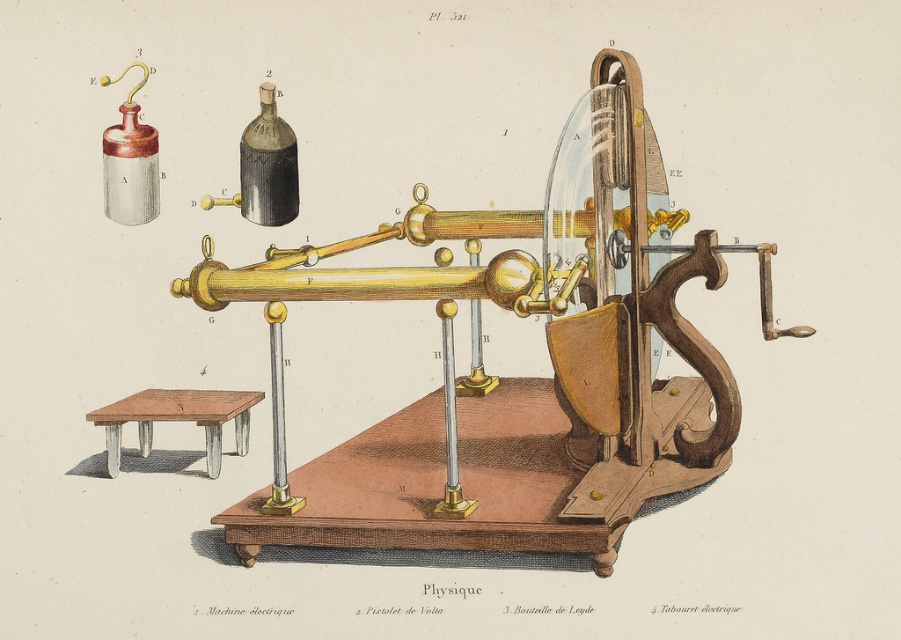
You are an engineer working on a precision instrument. You need to place a small tool between the polished brass telescope at center and the matte black glass bottle at upper center. The tool requires a minimum of 16 centimeters of space to operate. Can the tool fit in the space between them?

The polished brass telescope at center is 15.95 centimeters away from the matte black glass bottle at upper center. Since the required space is 16 centimeters, the tool cannot fit in the space between them.

You are an assistant in a historical laboratory and need to position a small tool between the polished brass telescope at center and the wooden stool at lower left. Based on their arrangement, which object should the tool be placed to the right of?

The tool should be placed to the right of the wooden stool at lower left because the polished brass telescope at center is located to its right, so placing the tool there would position it between the two objects.